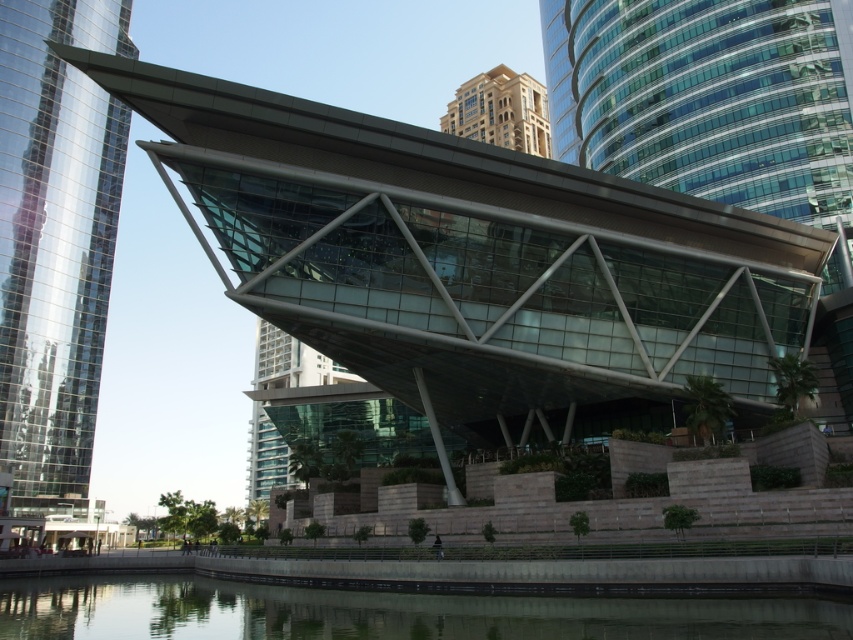
Is glassy reflective tower at left thinner than golden beige stone building at upper center?

Yes.

Who is positioned more to the right, glassy reflective tower at left or golden beige stone building at upper center?

Positioned to the right is golden beige stone building at upper center.

Between point (1, 456) and point (515, 145), which one is positioned behind?

The point (515, 145) is more distant.

Identify the location of glassy reflective tower at left. (55, 241).

Is point (552, 621) closer to camera compared to point (482, 96)?

Yes, point (552, 621) is closer to viewer.

Does point (445, 602) come behind point (537, 154)?

That is False.

This screenshot has height=640, width=853. I want to click on transparent glass water at lower center, so pos(381,612).

This screenshot has height=640, width=853. I want to click on transparent glass water at lower center, so click(x=381, y=612).

Between glassy reflective tower at left and transparent glass water at lower center, which one is positioned higher?

glassy reflective tower at left is higher up.

Is glassy reflective tower at left to the left of transparent glass water at lower center from the viewer's perspective?

Indeed, glassy reflective tower at left is positioned on the left side of transparent glass water at lower center.

Where is `glassy reflective tower at left`? Image resolution: width=853 pixels, height=640 pixels. glassy reflective tower at left is located at coordinates (55, 241).